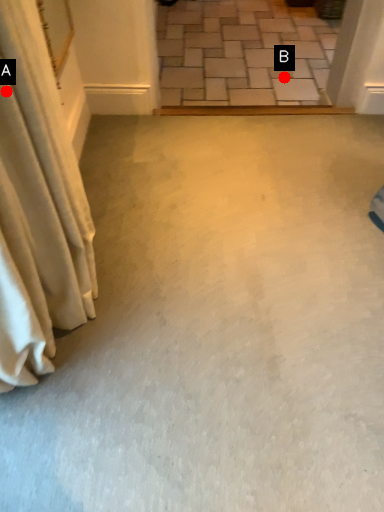
Question: Two points are circled on the image, labeled by A and B beside each circle. Which point is farther from the camera taking this photo?

Choices:
 (A) A is further
 (B) B is further

Answer: (B)